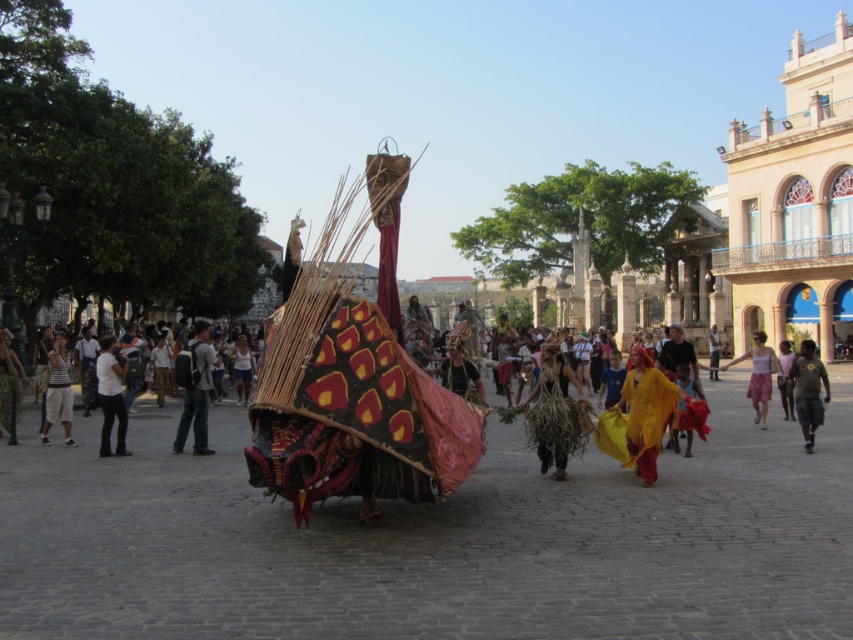
Who is shorter, camouflage fabric person at center or matte black t-shirt at center?

matte black t-shirt at center is shorter.

Where is `camouflage fabric person at center`? camouflage fabric person at center is located at coordinates [9, 387].

Locate an element on the screen. camouflage fabric person at center is located at coordinates (9, 387).

Which is below, camouflage fabric person at center or light brown fabric at center?

camouflage fabric person at center

Does camouflage fabric person at center appear on the right side of light brown fabric at center?

In fact, camouflage fabric person at center is to the left of light brown fabric at center.

Locate an element on the screen. The width and height of the screenshot is (853, 640). camouflage fabric person at center is located at coordinates (9, 387).

Can you confirm if green leafy costume at center is positioned to the left of light gray backpack at center?

No, green leafy costume at center is not to the left of light gray backpack at center.

Can you confirm if green leafy costume at center is positioned above light gray backpack at center?

Indeed, green leafy costume at center is positioned over light gray backpack at center.

Is point (543, 433) less distant than point (189, 360)?

Yes, it is.

Where is `green leafy costume at center`? The width and height of the screenshot is (853, 640). green leafy costume at center is located at coordinates (555, 412).